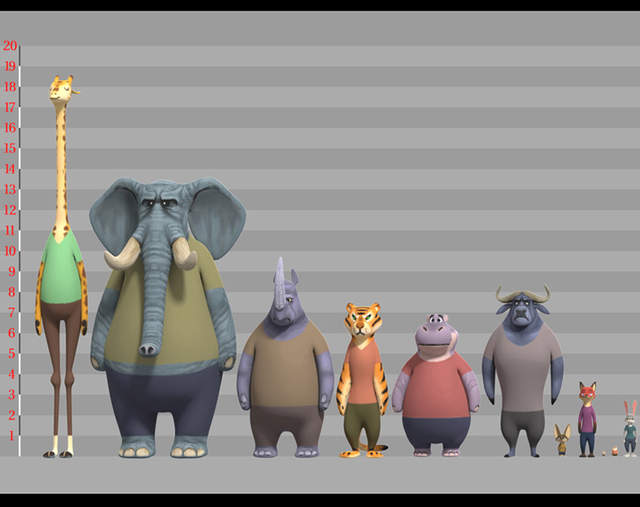
At what (x,y) coordinates should I click in order to perform the action: click on light gray lines on wall behind animals. Please return your answer as a coordinate pair (x, y). The width and height of the screenshot is (640, 507). Looking at the image, I should click on (484, 470), (484, 421), (486, 377), (475, 342), (465, 307), (476, 263), (486, 221), (499, 181), (499, 138), (497, 99).